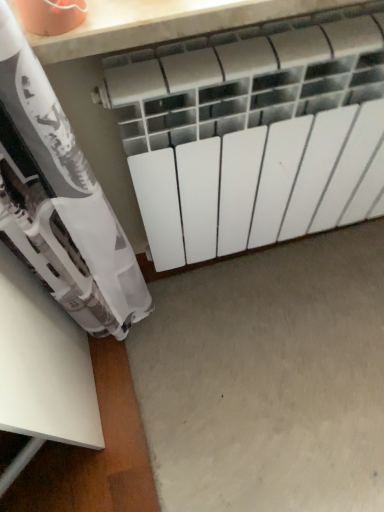
This screenshot has width=384, height=512. Find the location of `free point above white matte radiator at center (from a real-world perspective)`. free point above white matte radiator at center (from a real-world perspective) is located at coordinates (269, 39).